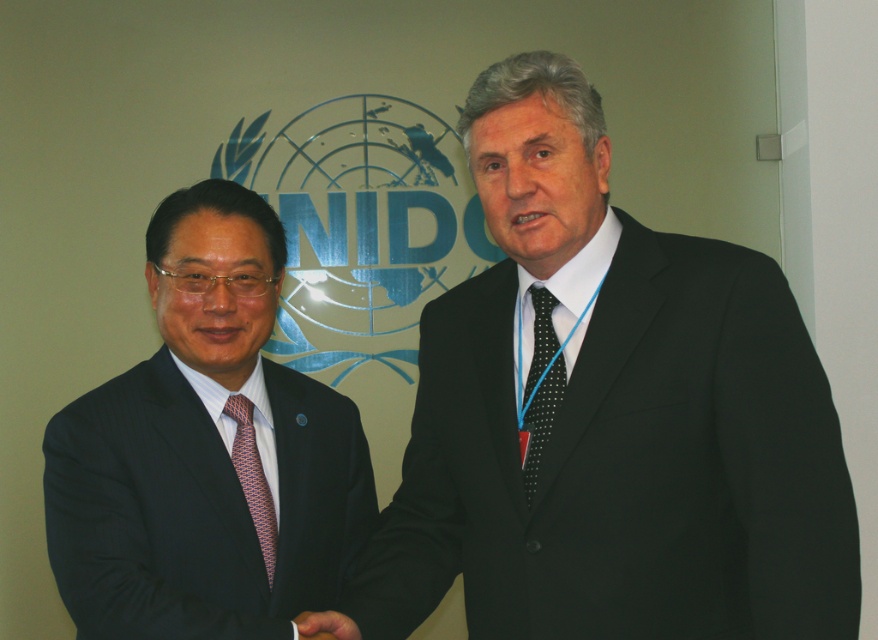
Question: Which point appears closest to the camera in this image?

Choices:
 (A) (231, 525)
 (B) (248, 493)

Answer: (A)

Question: Does black suit at center have a greater width compared to smooth skin hand at center?

Choices:
 (A) no
 (B) yes

Answer: (B)

Question: Is black dotted tie at center wider than smooth skin hand at center?

Choices:
 (A) no
 (B) yes

Answer: (A)

Question: Is black suit at center wider than black dotted tie at center?

Choices:
 (A) yes
 (B) no

Answer: (A)

Question: Which point is closer to the camera taking this photo?

Choices:
 (A) (623, 586)
 (B) (272, 531)

Answer: (A)

Question: Which point is farther from the camera taking this photo?

Choices:
 (A) (457, 496)
 (B) (321, 634)
 (C) (236, 467)
 (D) (227, 458)

Answer: (A)